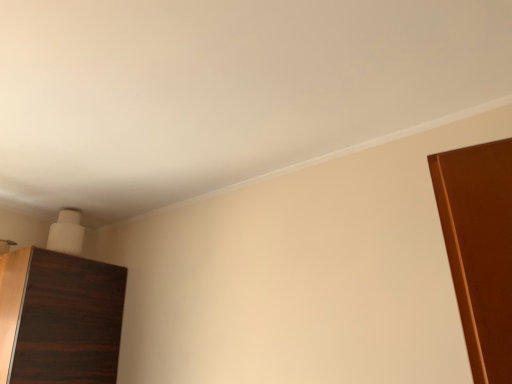
Where is `dark wood cabinet at lower left`? The width and height of the screenshot is (512, 384). dark wood cabinet at lower left is located at coordinates (59, 318).

What do you see at coordinates (59, 318) in the screenshot? The image size is (512, 384). I see `dark wood cabinet at lower left` at bounding box center [59, 318].

Where is `dark wood cabinet at lower left`? The height and width of the screenshot is (384, 512). dark wood cabinet at lower left is located at coordinates (59, 318).